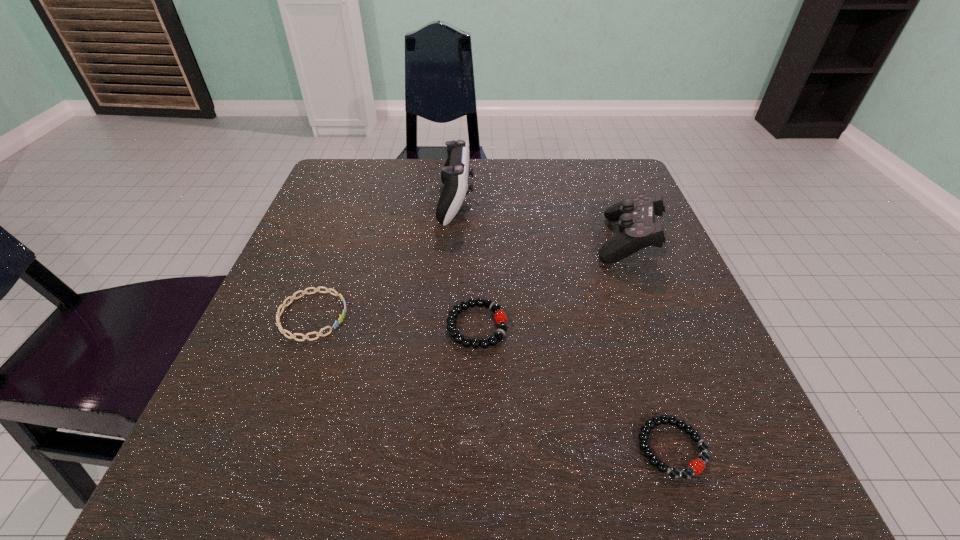
At what (x,y) coordinates should I click in order to perform the action: click on free space between the leftmost object and the second bracelet from right to left. Please return your answer as a coordinate pair (x, y). Looking at the image, I should click on (395, 321).

Identify the location of free space between the tallest object and the leftmost bracelet. (384, 259).

The height and width of the screenshot is (540, 960). I want to click on free space between the nearest bracelet and the shorter control, so click(649, 343).

At what (x,y) coordinates should I click in order to perform the action: click on empty space between the left control and the right control. Please return your answer as a coordinate pair (x, y). Looking at the image, I should click on coord(541,221).

In order to click on object that stands as the fourth closest to the leftmost bracelet in this screenshot , I will do click(x=635, y=215).

Select which object is the closest to the right control. Please provide its 2D coordinates. Your answer should be formatted as a tuple, i.e. [(x, y)], where the tuple contains the x and y coordinates of a point satisfying the conditions above.

[(484, 343)]

Locate an element on the screen. bracelet that is the nearest to the leftmost object is located at coordinates pos(484,343).

You are a GUI agent. You are given a task and a screenshot of the screen. Output one action in this format:
    pyautogui.click(x=<x>, y=<y>)
    Task: Click on the bracelet that is the third closest to the left control
    
    Given the screenshot: What is the action you would take?
    pyautogui.click(x=696, y=466)

Locate an element on the screen. vacant area that satisfies the following two spatial constraints: 1. on the surface of the leftmost bracelet showing star-shaped elements; 2. on the right side of the nearest bracelet is located at coordinates (263, 448).

I want to click on vacant point that satisfies the following two spatial constraints: 1. on the surface of the second bracelet from left to right showing star-shaped elements; 2. on the right side of the leftmost object, so click(x=309, y=326).